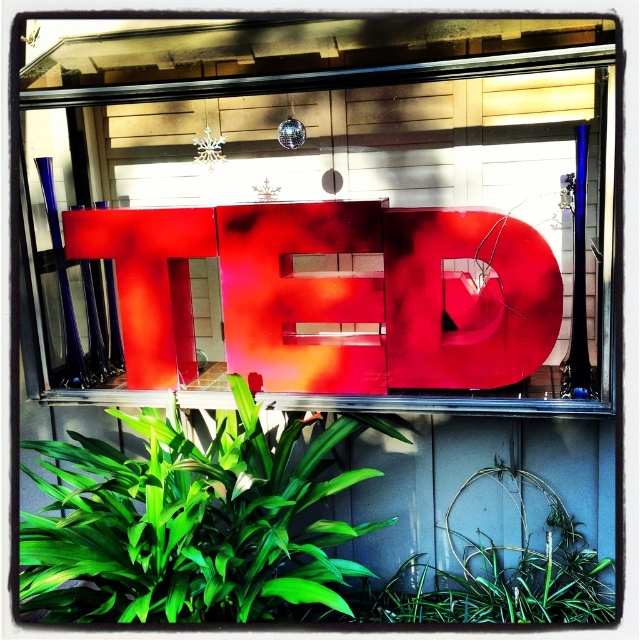
Question: Can you confirm if glossy plastic letter at center is bigger than green leafy plant at lower left?

Choices:
 (A) no
 (B) yes

Answer: (A)

Question: Which of the following is the farthest from the observer?

Choices:
 (A) green leafy plant at lower center
 (B) green leafy plant at lower left
 (C) glossy plastic letter at center

Answer: (A)

Question: Which point is farther to the camera?

Choices:
 (A) glossy plastic letter at center
 (B) green leafy plant at lower left

Answer: (A)

Question: Is glossy plastic letter at center smaller than green leafy plant at lower left?

Choices:
 (A) yes
 (B) no

Answer: (A)

Question: Observing the image, what is the correct spatial positioning of glossy plastic letter at center in reference to green leafy plant at lower center?

Choices:
 (A) right
 (B) left

Answer: (B)

Question: Based on their relative distances, which object is farther from the glossy plastic letter at center?

Choices:
 (A) green leafy plant at lower left
 (B) green leafy plant at lower center

Answer: (B)